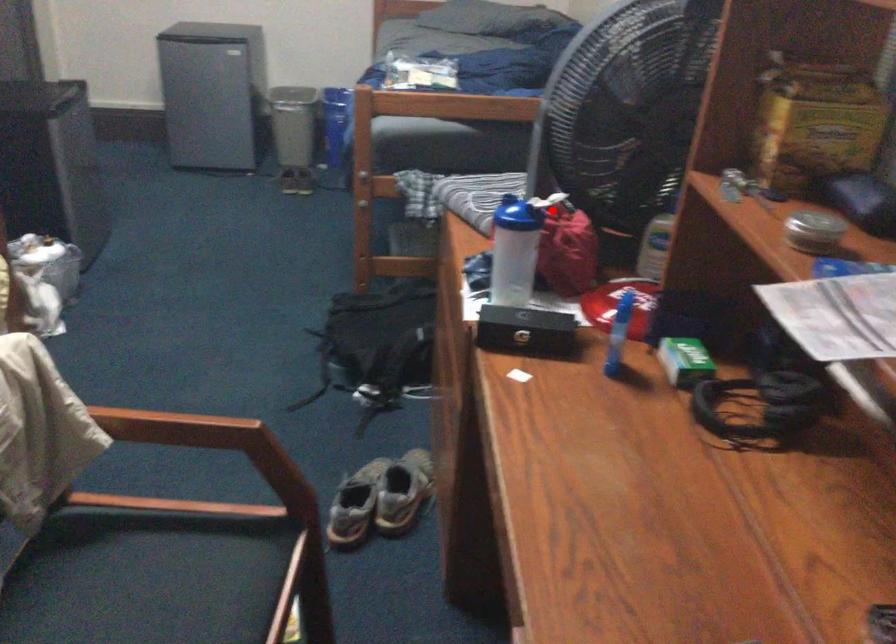
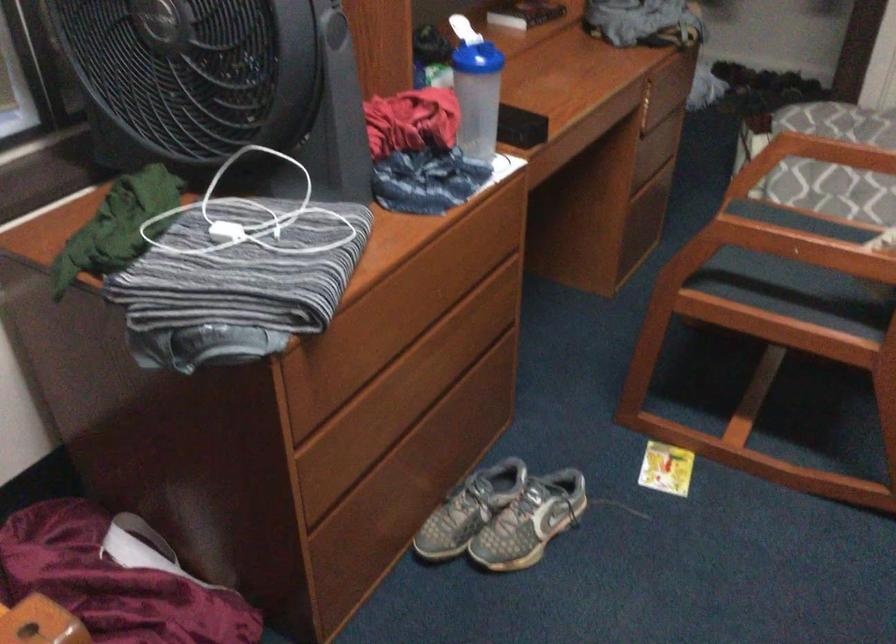
Question: I am providing you with two images of the same scene from different viewpoints. In image1, a red point is highlighted. Considering the same 3D point in image2, which of the following is correct?

Choices:
 (A) It is closer
 (B) It is farther

Answer: (A)